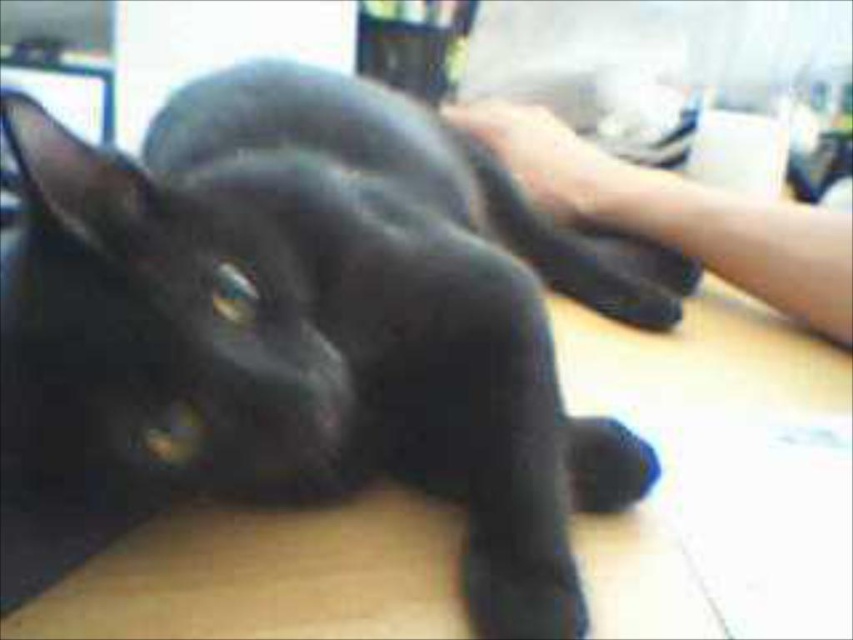
Is shiny black cat at center wider than black matte paw at center?

Yes.

Which of these two, shiny black cat at center or black matte paw at center, stands shorter?

With less height is black matte paw at center.

Is point (485, 282) positioned in front of point (584, 150)?

That is True.

Where is `shiny black cat at center`? Image resolution: width=853 pixels, height=640 pixels. shiny black cat at center is located at coordinates (305, 332).

Looking at this image, which is above, skinny white arm at upper right or black matte paw at center?

black matte paw at center is above.

Where is `skinny white arm at upper right`? Image resolution: width=853 pixels, height=640 pixels. skinny white arm at upper right is located at coordinates (677, 212).

Which is behind, point (648, 189) or point (618, 164)?

Point (618, 164)

Find the location of `skinny white arm at upper right`. skinny white arm at upper right is located at coordinates (677, 212).

How far apart are shiny black cat at center and skinny white arm at upper right?

shiny black cat at center is 10.08 inches away from skinny white arm at upper right.

Which is more to the left, shiny black cat at center or skinny white arm at upper right?

From the viewer's perspective, shiny black cat at center appears more on the left side.

Find the location of a particular element. The image size is (853, 640). shiny black cat at center is located at coordinates (305, 332).

Where is `shiny black cat at center`? shiny black cat at center is located at coordinates (305, 332).